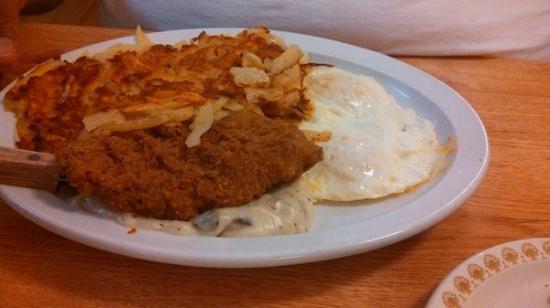
Identify the location of wood table. (513, 130).